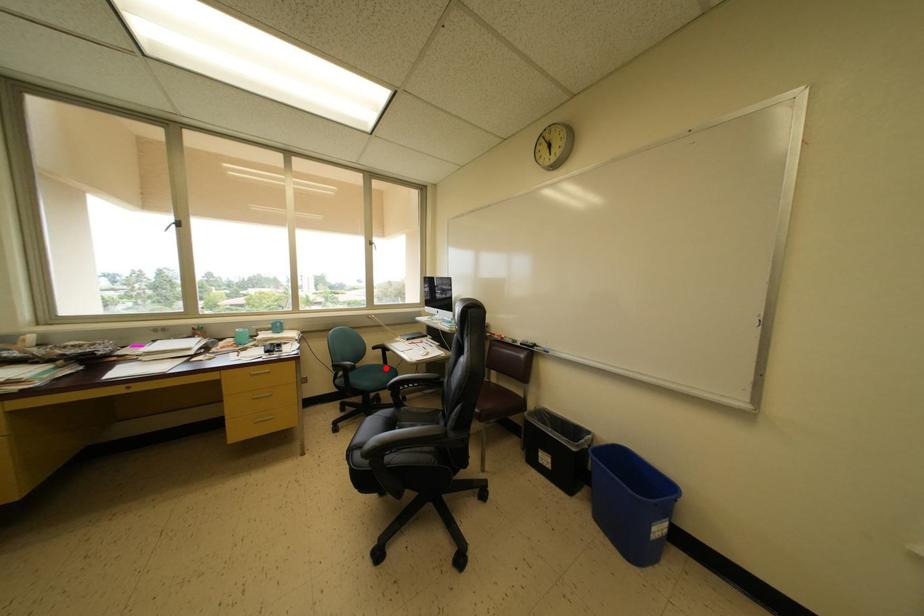
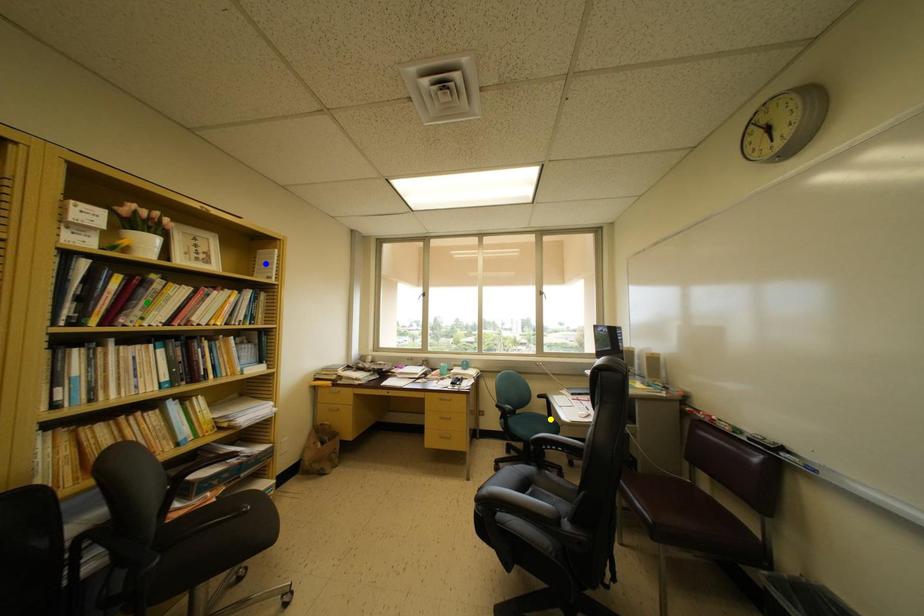
Question: I am providing you with two images of the same scene from different viewpoints. A red point is marked on the first image. You are given multiple points on the second image. Which mark in image 2 goes with the point in image 1?

Choices:
 (A) yellow point
 (B) green point
 (C) blue point

Answer: (A)